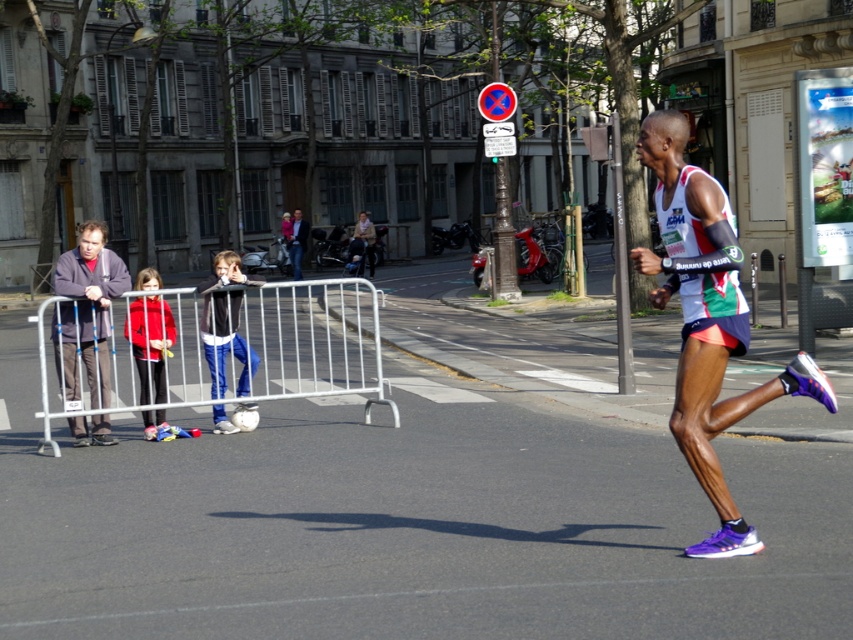
Question: Among these objects, which one is nearest to the camera?

Choices:
 (A) silver metallic barricade at left
 (B) matte black jacket at center

Answer: (A)

Question: Does red fleece jacket at left appear on the right side of matte black jacket at center?

Choices:
 (A) yes
 (B) no

Answer: (A)

Question: Which point appears closest to the camera in this image?

Choices:
 (A) (207, 316)
 (B) (299, 227)
 (C) (54, 358)
 (D) (155, 317)

Answer: (D)

Question: In this image, where is gray fabric jacket at left located relative to matte black jacket at center?

Choices:
 (A) above
 (B) below

Answer: (B)

Question: Does gray fabric jacket at left come in front of blue jeans at center?

Choices:
 (A) yes
 (B) no

Answer: (A)

Question: Which point is farther to the camera?

Choices:
 (A) silver metallic barricade at left
 (B) matte black jacket at center

Answer: (B)